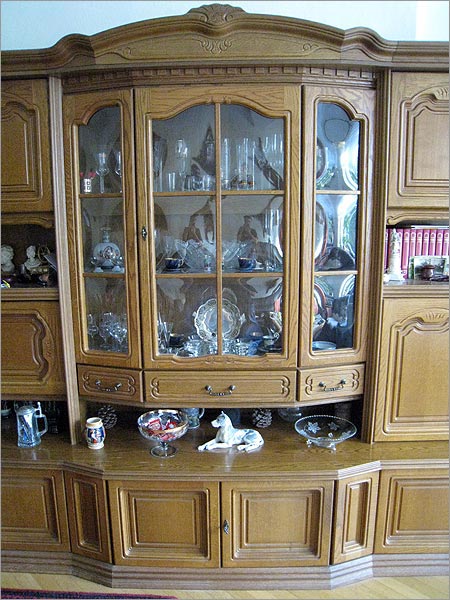
Where is `knob`? knob is located at coordinates (225, 528).